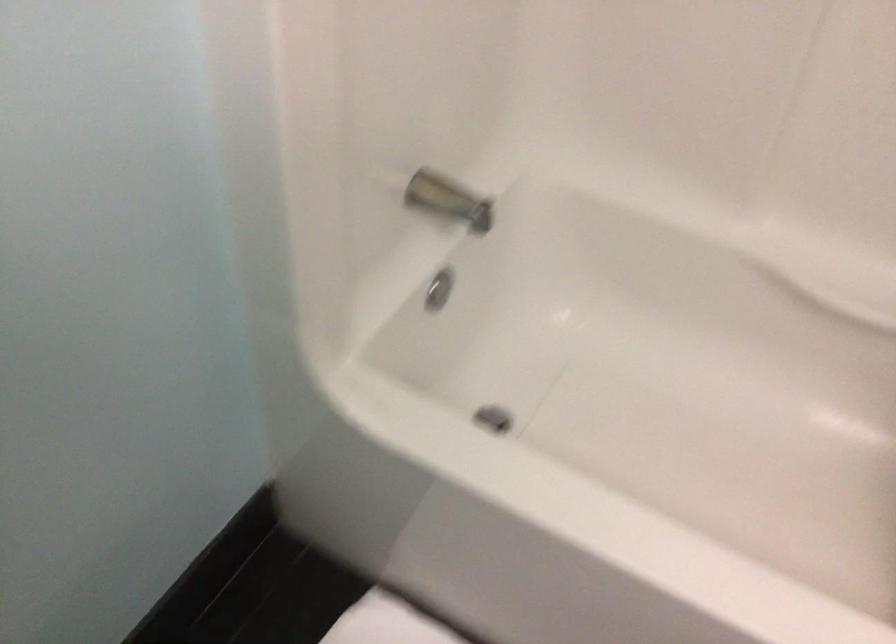
Locate an element on the screen. metal faucet diverter is located at coordinates (449, 200).